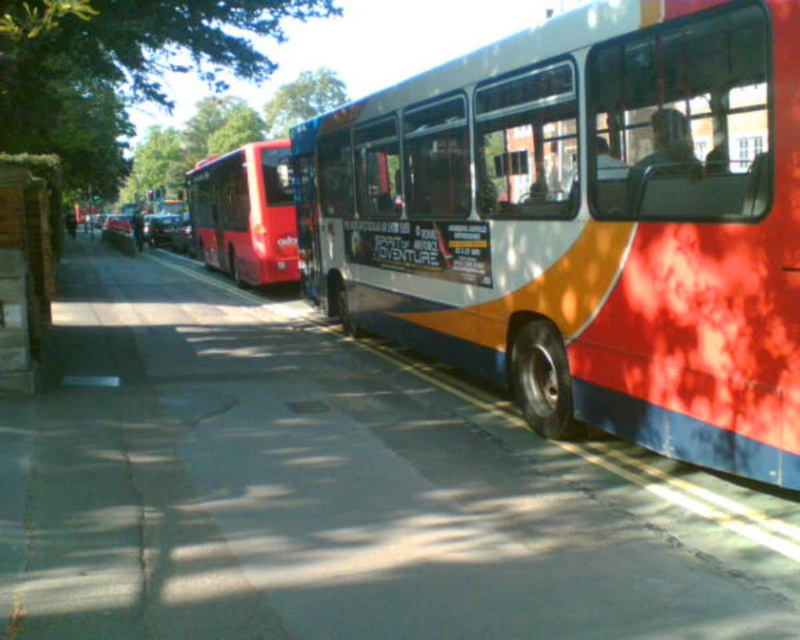
Question: Which is farther from the green leafy tree at upper center?

Choices:
 (A) shiny red bus at center
 (B) green leafy tree at upper left
 (C) white glossy bus at center

Answer: (C)

Question: Considering the real-world distances, which object is closest to the shiny red bus at center?

Choices:
 (A) white glossy bus at center
 (B) wooden post at left

Answer: (B)

Question: Is green leafy tree at upper left closer to camera compared to green leafy tree at upper center?

Choices:
 (A) yes
 (B) no

Answer: (A)

Question: Which is nearer to the green leafy tree at upper left?

Choices:
 (A) green leafy tree at upper center
 (B) wooden post at left

Answer: (A)

Question: Does green leafy tree at upper left have a smaller size compared to shiny red bus at center?

Choices:
 (A) no
 (B) yes

Answer: (A)

Question: Can you confirm if green leafy tree at upper left is positioned to the left of wooden post at left?

Choices:
 (A) yes
 (B) no

Answer: (A)